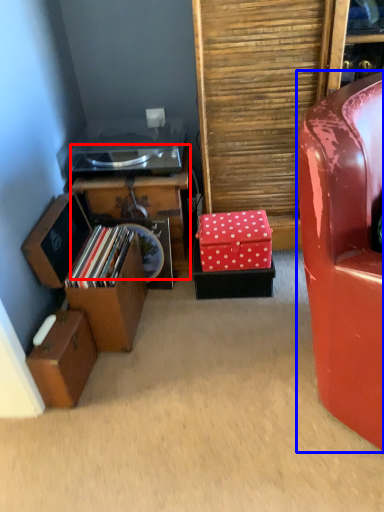
Question: Which of the following is the farthest to the observer, furniture (highlighted by a red box) or chair (highlighted by a blue box)?

Choices:
 (A) furniture
 (B) chair

Answer: (A)